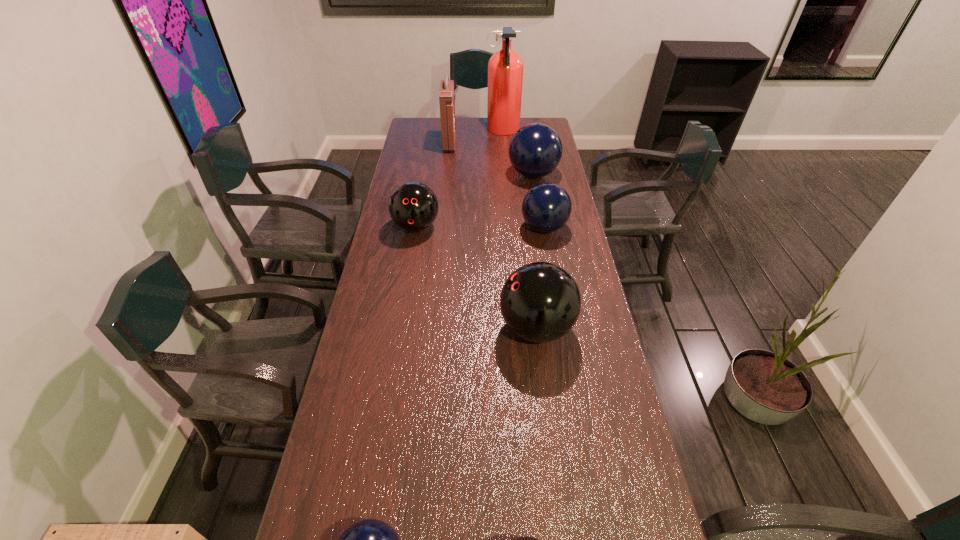
Locate an element on the screen. vacant area situated 0.370m on the left of the tallest object is located at coordinates (417, 131).

Where is `free space located on the front-facing side of the red first-aid kit`? free space located on the front-facing side of the red first-aid kit is located at coordinates (469, 146).

At what (x,y) coordinates should I click in order to perform the action: click on vacant region located on the surface of the farthest blue bowling ball near the finger holes. Please return your answer as a coordinate pair (x, y). This screenshot has width=960, height=540. Looking at the image, I should click on (432, 174).

Locate an element on the screen. free location located on the surface of the farthest blue bowling ball near the finger holes is located at coordinates (484, 174).

At what (x,y) coordinates should I click in order to perform the action: click on vacant space located on the surface of the farthest blue bowling ball near the finger holes. Please return your answer as a coordinate pair (x, y). The width and height of the screenshot is (960, 540). Looking at the image, I should click on (428, 174).

At what (x,y) coordinates should I click in order to perform the action: click on free space located 0.400m on the surface of the biggest black bowling ball near the finger holes. Please return your answer as a coordinate pair (x, y). The image size is (960, 540). Looking at the image, I should click on (372, 328).

Image resolution: width=960 pixels, height=540 pixels. Find the location of `free region located on the surface of the biggest black bowling ball near the finger holes`. free region located on the surface of the biggest black bowling ball near the finger holes is located at coordinates (385, 328).

Find the location of a particular element. The image size is (960, 540). vacant space located 0.320m on the surface of the biggest black bowling ball near the finger holes is located at coordinates (397, 328).

Where is `vacant space situated on the surface of the second biggest black bowling ball near the finger holes`? This screenshot has height=540, width=960. vacant space situated on the surface of the second biggest black bowling ball near the finger holes is located at coordinates (404, 296).

Locate an element on the screen. This screenshot has width=960, height=540. free point located 0.350m on the surface of the second biggest blue bowling ball near the finger holes is located at coordinates (432, 228).